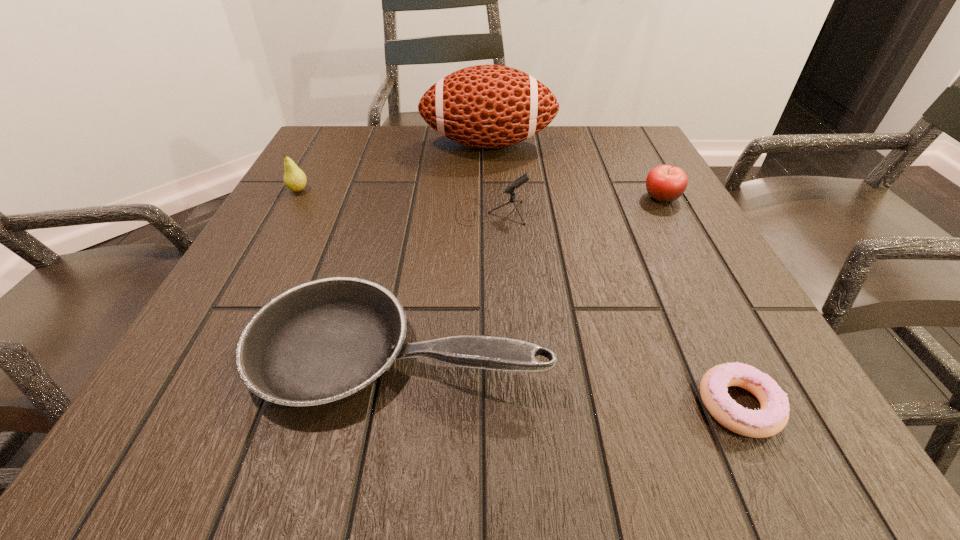
The height and width of the screenshot is (540, 960). I want to click on object identified as the fifth closest to the microphone, so click(773, 416).

Identify which object is the fourth closest to the microphone. Please provide its 2D coordinates. Your answer should be formatted as a tuple, i.e. [(x, y)], where the tuple contains the x and y coordinates of a point satisfying the conditions above.

[(295, 179)]

This screenshot has width=960, height=540. I want to click on vacant space that satisfies the following two spatial constraints: 1. on the stand of the microphone; 2. on the front side of the frying pan, so click(496, 350).

Locate an element on the screen. vacant space that satisfies the following two spatial constraints: 1. on the stand of the microphone; 2. on the right side of the doughnut is located at coordinates (498, 405).